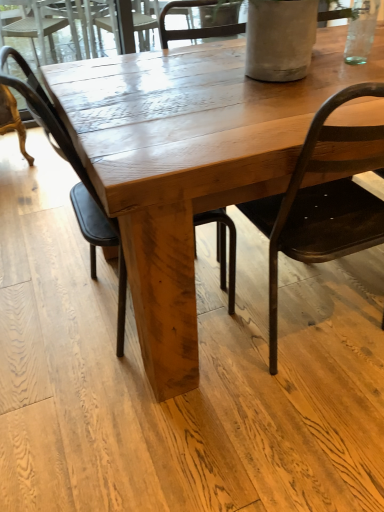
Question: Is matte black chair at right, which appears as the first chair when viewed from the right, in front of wooden table at center?

Choices:
 (A) no
 (B) yes

Answer: (B)

Question: Can we say matte black chair at right, acting as the 2th chair starting from the left, lies outside wooden table at center?

Choices:
 (A) yes
 (B) no

Answer: (B)

Question: Does matte black chair at right, which appears as the first chair when viewed from the right, have a larger size compared to wooden table at center?

Choices:
 (A) no
 (B) yes

Answer: (A)

Question: Does matte black chair at right, which appears as the first chair when viewed from the right, come behind wooden table at center?

Choices:
 (A) no
 (B) yes

Answer: (A)

Question: Are matte black chair at right, acting as the 2th chair starting from the left, and wooden table at center located far from each other?

Choices:
 (A) yes
 (B) no

Answer: (B)

Question: Does matte black chair at right, acting as the 2th chair starting from the left, contain wooden table at center?

Choices:
 (A) no
 (B) yes

Answer: (A)

Question: Considering the relative positions of matte black chair at center, the first chair from the left, and matte black chair at right, which appears as the first chair when viewed from the right, in the image provided, is matte black chair at center, the first chair from the left, to the left of matte black chair at right, which appears as the first chair when viewed from the right, from the viewer's perspective?

Choices:
 (A) no
 (B) yes

Answer: (B)

Question: Considering the relative positions of matte black chair at center, which is counted as the 2th chair, starting from the right, and matte black chair at right, which appears as the first chair when viewed from the right, in the image provided, is matte black chair at center, which is counted as the 2th chair, starting from the right, to the right of matte black chair at right, which appears as the first chair when viewed from the right, from the viewer's perspective?

Choices:
 (A) yes
 (B) no

Answer: (B)

Question: Is matte black chair at center, which is counted as the 2th chair, starting from the right, touching matte black chair at right, which appears as the first chair when viewed from the right?

Choices:
 (A) yes
 (B) no

Answer: (B)

Question: Is matte black chair at center, the first chair from the left, aimed at matte black chair at right, which appears as the first chair when viewed from the right?

Choices:
 (A) yes
 (B) no

Answer: (A)

Question: Does matte black chair at center, the first chair from the left, have a smaller size compared to matte black chair at right, acting as the 2th chair starting from the left?

Choices:
 (A) yes
 (B) no

Answer: (A)

Question: Does matte black chair at center, which is counted as the 2th chair, starting from the right, have a larger size compared to matte black chair at right, which appears as the first chair when viewed from the right?

Choices:
 (A) yes
 (B) no

Answer: (B)

Question: Can you confirm if matte black chair at center, the first chair from the left, is bigger than wooden table at center?

Choices:
 (A) yes
 (B) no

Answer: (B)